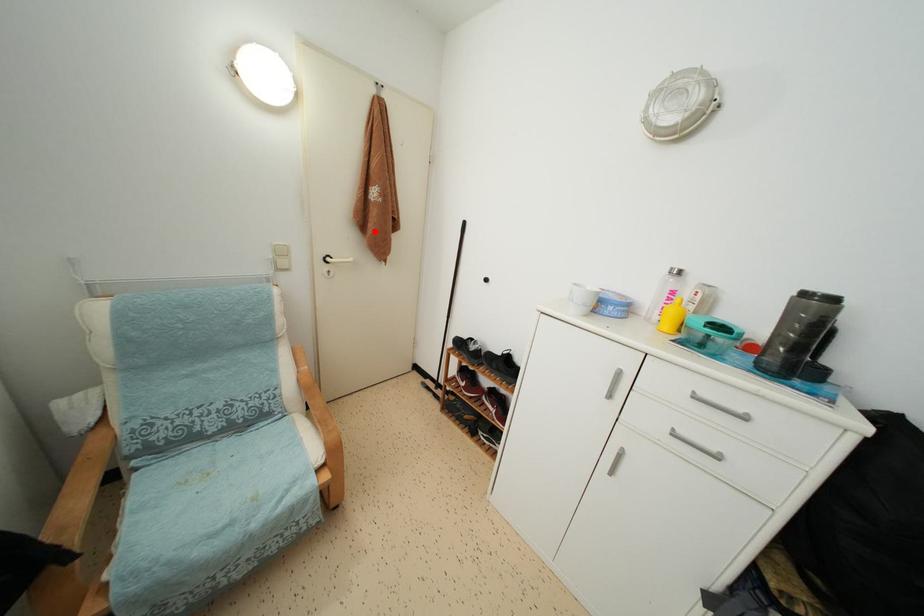
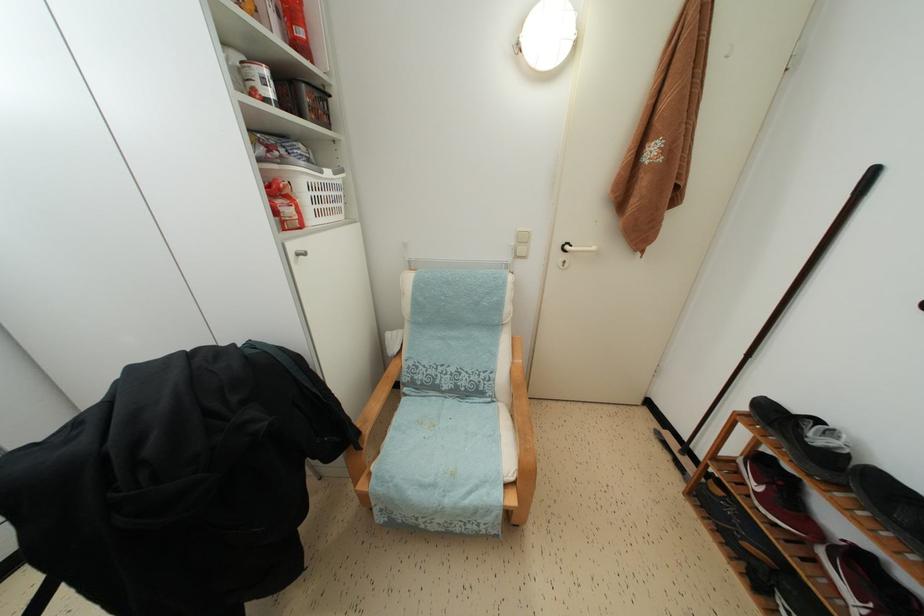
The point at the highlighted location is marked in the first image. Where is the corresponding point in the second image?

(638, 207)